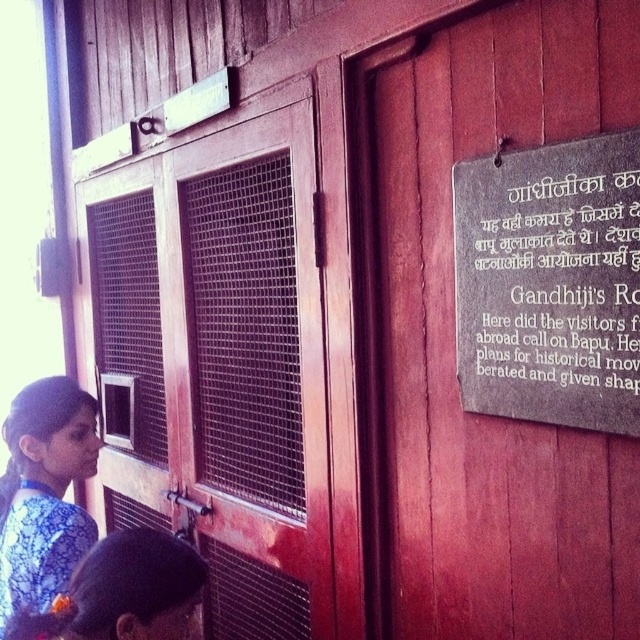
You are standing in front of the wooden structure and see the wooden door at center and the blue printed dress at lower left. Which object is positioned to the right of the other?

The wooden door at center is to the right of blue printed dress at lower left.

From the picture: You are a delivery person trying to place a package on the floor near the blue printed dress at lower left. The wooden door at center is in your way. Can you move the package around the door to the desired location without moving the door?

The wooden door at center is 92.45 centimeters away from the blue printed dress at lower left. Since the distance between them is sufficient, you can move the package around the door to the desired location without needing to move the door itself.